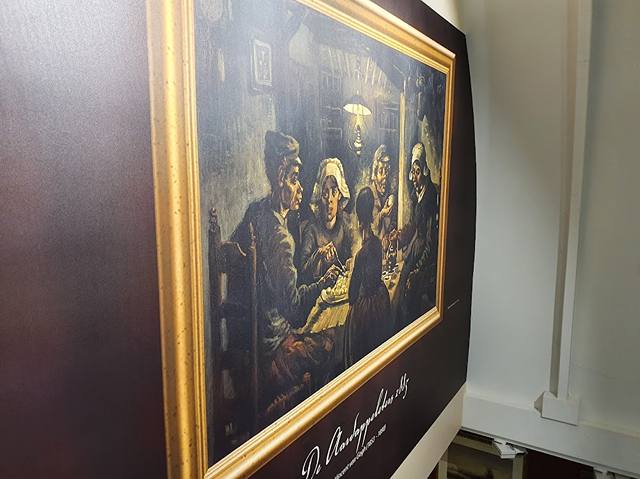
Identify the location of food on plate. Image resolution: width=640 pixels, height=479 pixels. pos(338,292).